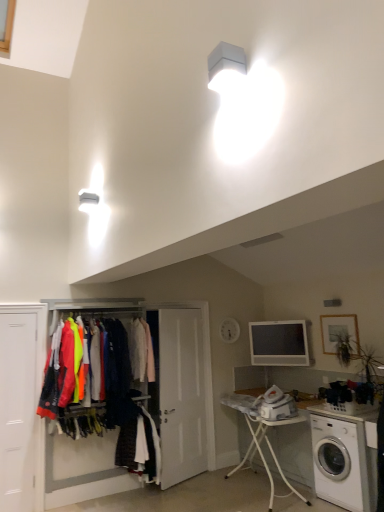
Question: Considering the positions of matte gray monitor at center and white fabric coat at center, acting as the 1th clothing starting from the top, in the image, is matte gray monitor at center taller or shorter than white fabric coat at center, acting as the 1th clothing starting from the top,?

Choices:
 (A) tall
 (B) short

Answer: (B)

Question: Considering the positions of matte gray monitor at center and white fabric coat at center, acting as the 1th clothing starting from the top, in the image, is matte gray monitor at center wider or thinner than white fabric coat at center, acting as the 1th clothing starting from the top,?

Choices:
 (A) thin
 (B) wide

Answer: (A)

Question: Estimate the real-world distances between objects in this image. Which object is farther from the neon fabric jackets at center, which is the second clothing from bottom to top?

Choices:
 (A) white plastic washing machine at lower right
 (B) white matte door at left
 (C) matte gray lamp at upper center
 (D) white fabric coat at center, acting as the 1th clothing starting from the top
 (E) white cotton shirt at center, which is counted as the 1th clothing, starting from the bottom

Answer: (C)

Question: Which of these objects is positioned closest to the white matte door at left?

Choices:
 (A) matte plastic clothes rack at lower left
 (B) matte gray lamp at upper center
 (C) white plastic ironing board at lower center
 (D) white glossy door at center
 (E) white cotton shirt at center, which is counted as the 1th clothing, starting from the bottom

Answer: (A)